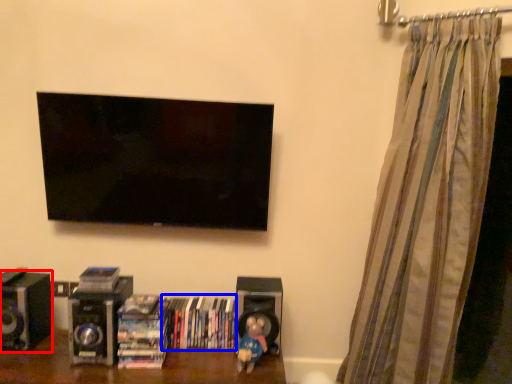
Question: Which object appears farthest to the camera in this image, speaker (highlighted by a red box) or book (highlighted by a blue box)?

Choices:
 (A) speaker
 (B) book

Answer: (B)